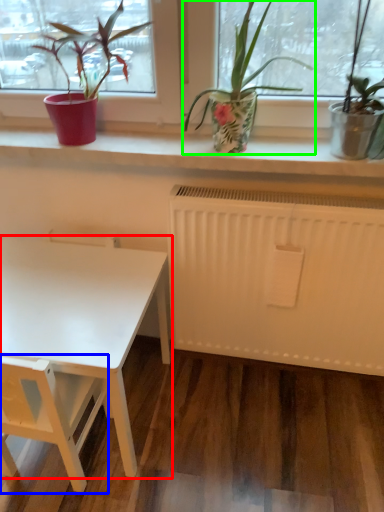
Question: Which object is positioned closest to table (highlighted by a red box)? Select from armchair (highlighted by a blue box) and houseplant (highlighted by a green box).

Choices:
 (A) armchair
 (B) houseplant

Answer: (A)